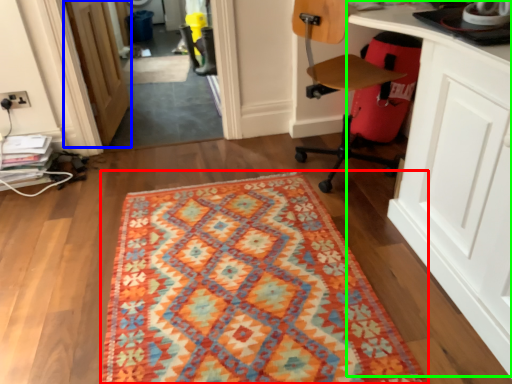
Question: Which object is the farthest from mat (highlighted by a red box)? Choose among these: door (highlighted by a blue box) or computer desk (highlighted by a green box).

Choices:
 (A) door
 (B) computer desk

Answer: (A)